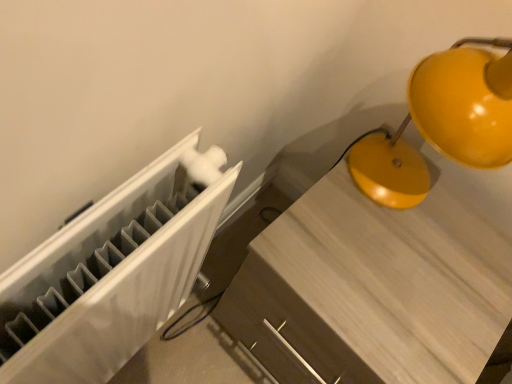
This screenshot has width=512, height=384. Find the location of `empty space that is ontop of matte wood table at center (from a real-world perspective)`. empty space that is ontop of matte wood table at center (from a real-world perspective) is located at coordinates (402, 253).